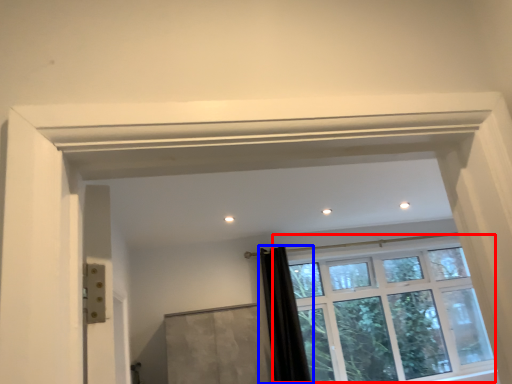
Question: Which object is further to the camera taking this photo, window (highlighted by a red box) or shower curtain (highlighted by a blue box)?

Choices:
 (A) window
 (B) shower curtain

Answer: (A)